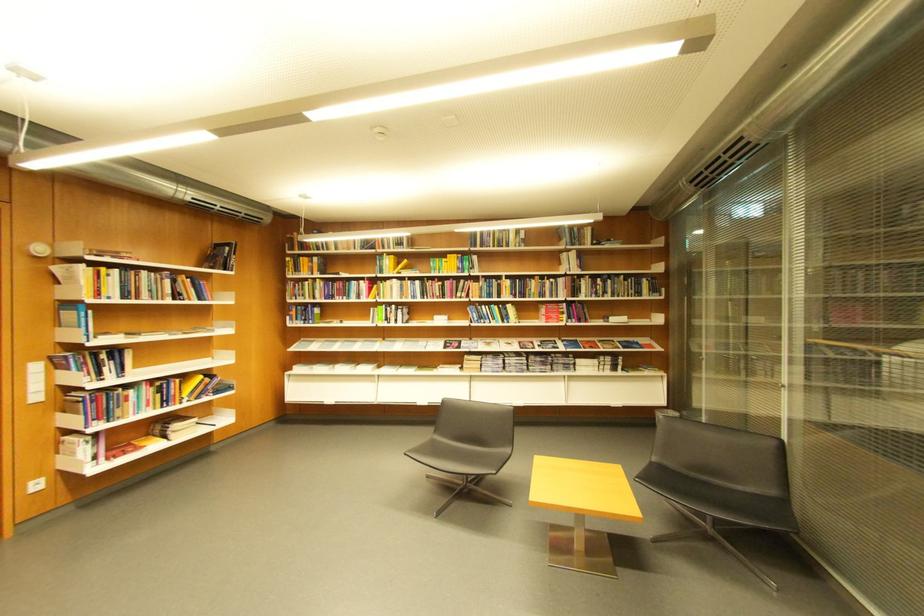
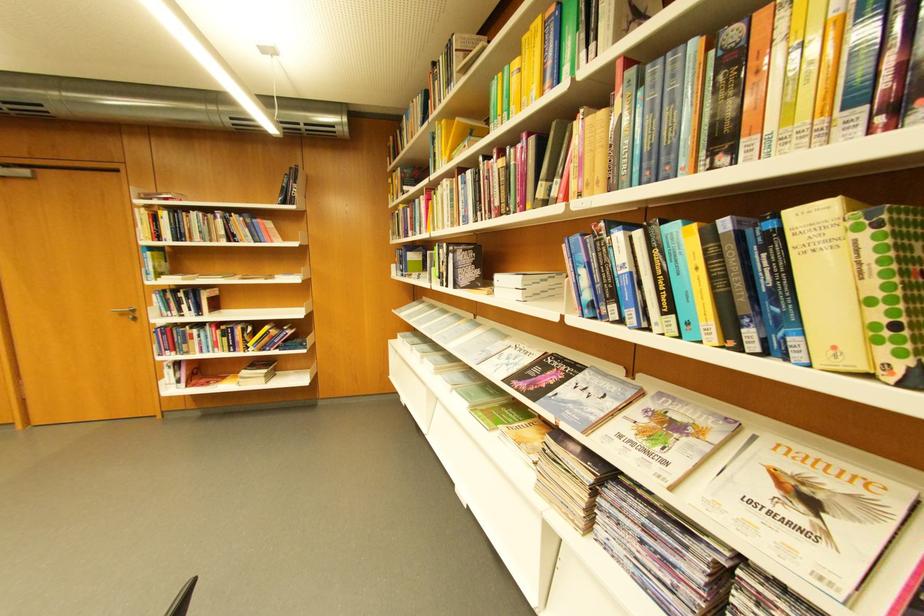
Locate, in the second image, the point that corresponds to point (505, 321) in the first image.

(681, 310)